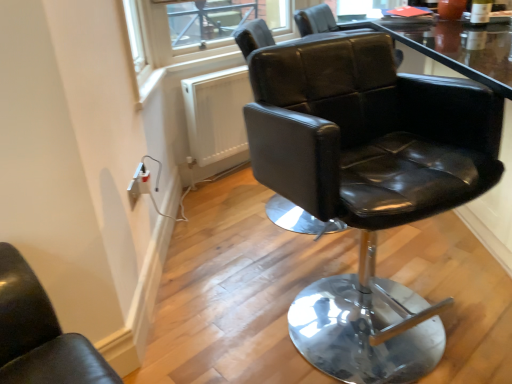
Identify the location of black leather chair at center. (367, 184).

This screenshot has width=512, height=384. What do you see at coordinates (367, 184) in the screenshot?
I see `black leather chair at center` at bounding box center [367, 184].

What do you see at coordinates (216, 21) in the screenshot?
I see `transparent glass window screen at upper center` at bounding box center [216, 21].

Identify the location of transparent glass window screen at upper center. (216, 21).

The image size is (512, 384). I want to click on black leather chair at center, so click(367, 184).

Considering the relative positions of black leather chair at center and transparent glass window screen at upper center in the image provided, is black leather chair at center to the left or to the right of transparent glass window screen at upper center?

black leather chair at center is to the right of transparent glass window screen at upper center.

Which object is closer to the camera, black leather chair at center or transparent glass window screen at upper center?

black leather chair at center is closer to the camera.

Considering the positions of point (380, 359) and point (209, 40), is point (380, 359) closer or farther from the camera than point (209, 40)?

Point (380, 359) is positioned closer to the camera compared to point (209, 40).

From the image's perspective, is black leather chair at center on top of transparent glass window screen at upper center?

Actually, black leather chair at center appears below transparent glass window screen at upper center in the image.

From a real-world perspective, is black leather chair at center positioned under transparent glass window screen at upper center based on gravity?

Indeed, from a real-world perspective, black leather chair at center is positioned beneath transparent glass window screen at upper center.

Does black leather chair at center have a greater width compared to transparent glass window screen at upper center?

Yes.

Can you confirm if black leather chair at center is shorter than transparent glass window screen at upper center?

Incorrect, the height of black leather chair at center does not fall short of that of transparent glass window screen at upper center.

Between black leather chair at center and transparent glass window screen at upper center, which one has smaller size?

Smaller between the two is transparent glass window screen at upper center.

Does black leather chair at center contain transparent glass window screen at upper center?

No, black leather chair at center does not contain transparent glass window screen at upper center.

Is black leather chair at center placed right next to transparent glass window screen at upper center?

No, black leather chair at center is not making contact with transparent glass window screen at upper center.

Is black leather chair at center oriented towards transparent glass window screen at upper center?

No, black leather chair at center is not facing towards transparent glass window screen at upper center.

How distant is black leather chair at center from transparent glass window screen at upper center?

black leather chair at center and transparent glass window screen at upper center are 3.84 feet apart.

Where is `window screen that appears above the black leather chair at center (from a real-world perspective)`? Image resolution: width=512 pixels, height=384 pixels. window screen that appears above the black leather chair at center (from a real-world perspective) is located at coordinates (216, 21).

Which object is positioned more to the left, transparent glass window screen at upper center or black leather chair at center?

From the viewer's perspective, transparent glass window screen at upper center appears more on the left side.

From the picture: Is transparent glass window screen at upper center in front of or behind black leather chair at center in the image?

transparent glass window screen at upper center is behind black leather chair at center.

Is point (227, 37) less distant than point (318, 82)?

No.

From the image's perspective, between transparent glass window screen at upper center and black leather chair at center, which one is located above?

transparent glass window screen at upper center, from the image's perspective.

From a real-world perspective, which object rests below the other?

black leather chair at center is physically lower.

In terms of width, does transparent glass window screen at upper center look wider or thinner when compared to black leather chair at center?

Considering their sizes, transparent glass window screen at upper center looks slimmer than black leather chair at center.

Can you confirm if transparent glass window screen at upper center is taller than black leather chair at center?

No, transparent glass window screen at upper center is not taller than black leather chair at center.

Looking at the image, does transparent glass window screen at upper center seem bigger or smaller compared to black leather chair at center?

In the image, transparent glass window screen at upper center appears to be smaller than black leather chair at center.

Is transparent glass window screen at upper center outside of black leather chair at center?

Absolutely, transparent glass window screen at upper center is external to black leather chair at center.

Is there a large distance between transparent glass window screen at upper center and black leather chair at center?

That's right, there is a large distance between transparent glass window screen at upper center and black leather chair at center.

Does transparent glass window screen at upper center turn towards black leather chair at center?

Yes, transparent glass window screen at upper center is oriented towards black leather chair at center.

At what (x,y) coordinates should I click in order to perform the action: click on chair that appears on the right of transparent glass window screen at upper center. Please return your answer as a coordinate pair (x, y). Looking at the image, I should click on (367, 184).

Image resolution: width=512 pixels, height=384 pixels. Identify the location of chair below the transparent glass window screen at upper center (from the image's perspective). (367, 184).

At what (x,y) coordinates should I click in order to perform the action: click on chair that appears on the right of transparent glass window screen at upper center. Please return your answer as a coordinate pair (x, y). Image resolution: width=512 pixels, height=384 pixels. Looking at the image, I should click on (367, 184).